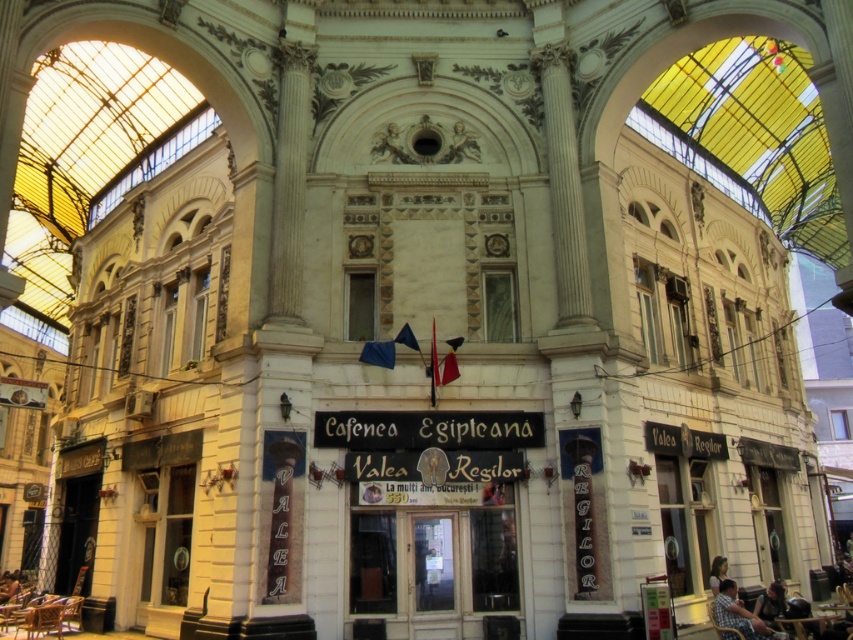
Between dark blue fabric shirt at lower right and blonde hair at lower right, which one is positioned lower?

dark blue fabric shirt at lower right is below.

What do you see at coordinates (770, 604) in the screenshot?
I see `dark blue fabric shirt at lower right` at bounding box center [770, 604].

I want to click on dark blue fabric shirt at lower right, so click(x=770, y=604).

Between plaid shirt at lower right and dark blue fabric shirt at lower right, which one has less height?

Standing shorter between the two is dark blue fabric shirt at lower right.

Between plaid shirt at lower right and dark blue fabric shirt at lower right, which one has more height?

Standing taller between the two is plaid shirt at lower right.

Find the location of a particular element. This screenshot has width=853, height=640. plaid shirt at lower right is located at coordinates (737, 612).

Is point (711, 573) more distant than point (12, 595)?

No.

Which of these two, blonde hair at lower right or dark brown leather chair at lower left, stands taller?

dark brown leather chair at lower left

Does point (718, 564) lie behind point (16, 570)?

That is False.

This screenshot has width=853, height=640. In order to click on blonde hair at lower right in this screenshot , I will do `click(717, 572)`.